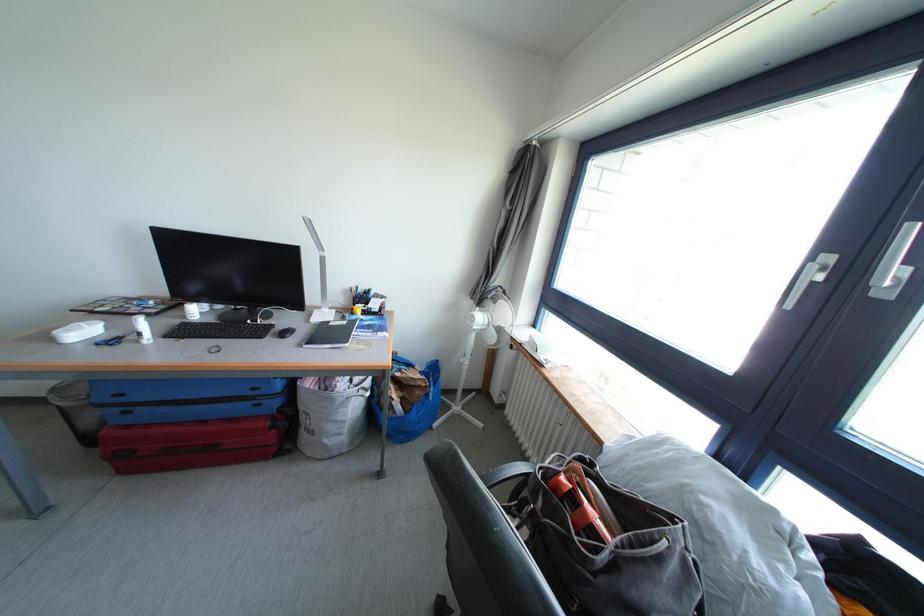
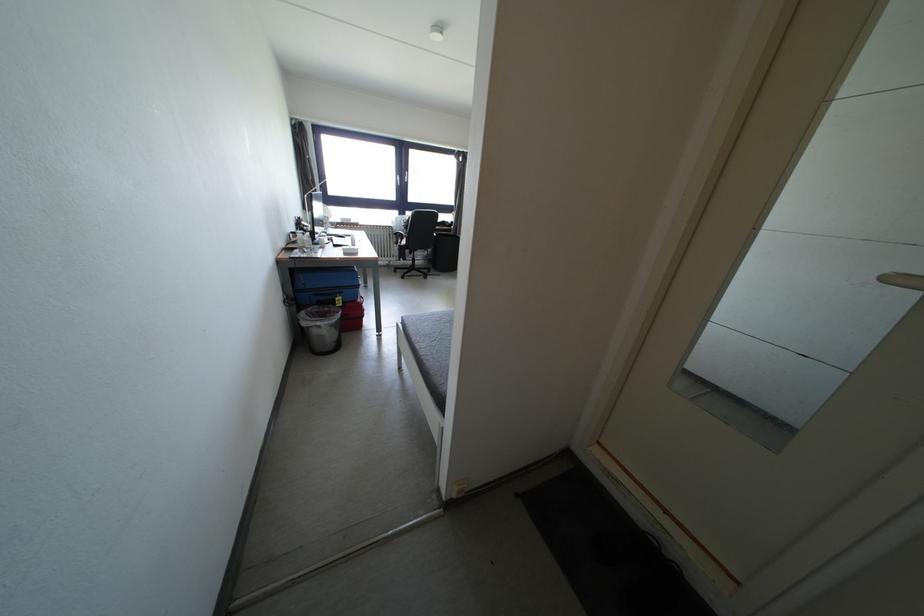
Question: I am providing you with two images of the same scene from different viewpoints. After the viewpoint changes to image2, which objects are now occluded?

Choices:
 (A) sofa sitting surface
 (B) orange utility knife
 (C) white spray bottle
 (D) chair sitting surface

Answer: (C)